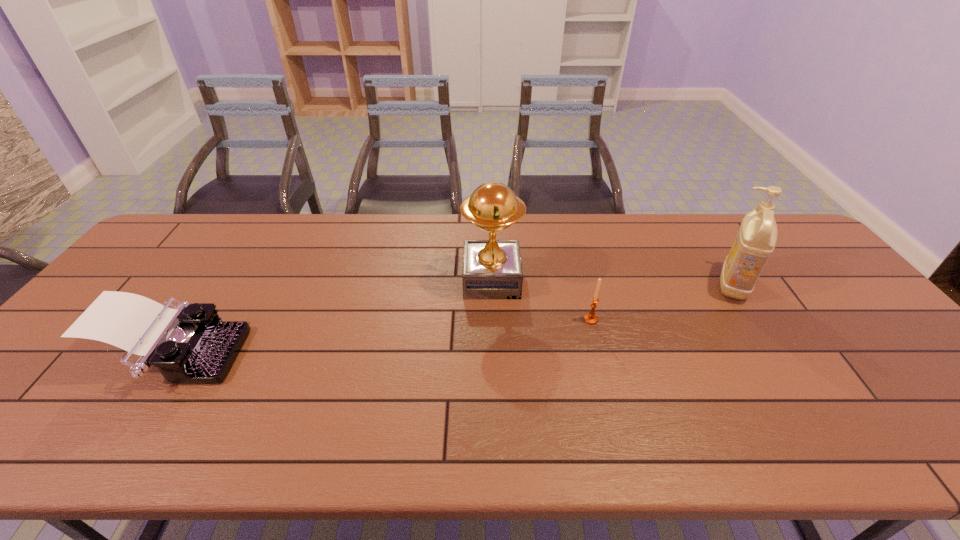
Locate an element on the screen. Image resolution: width=960 pixels, height=540 pixels. vacant space at the far edge of the desktop is located at coordinates (x=303, y=216).

In order to click on vacant region at the near edge in this screenshot , I will do `click(841, 453)`.

At what (x,y) coordinates should I click in order to perform the action: click on vacant space at the left edge of the desktop. Please return your answer as a coordinate pair (x, y). This screenshot has height=540, width=960. Looking at the image, I should click on (134, 280).

This screenshot has height=540, width=960. Find the location of `vacant position at the right edge of the desktop`. vacant position at the right edge of the desktop is located at coordinates 776,268.

In the image, there is a desktop. What are the coordinates of `vacant space at the near right corner` in the screenshot? It's located at (929, 427).

Where is `empty space between the third object from left to right and the leftmost object`? empty space between the third object from left to right and the leftmost object is located at coordinates (384, 338).

Where is `empty space that is in between the candle_holder and the detergent`? The image size is (960, 540). empty space that is in between the candle_holder and the detergent is located at coordinates (662, 302).

Where is `free spot between the leftmost object and the candle_holder`? free spot between the leftmost object and the candle_holder is located at coordinates (384, 338).

Where is `vacant space that is in between the detergent and the leftmost object`? The height and width of the screenshot is (540, 960). vacant space that is in between the detergent and the leftmost object is located at coordinates (455, 321).

Image resolution: width=960 pixels, height=540 pixels. Find the location of `blank region between the third object from right to left and the third object from left to right`. blank region between the third object from right to left and the third object from left to right is located at coordinates (541, 300).